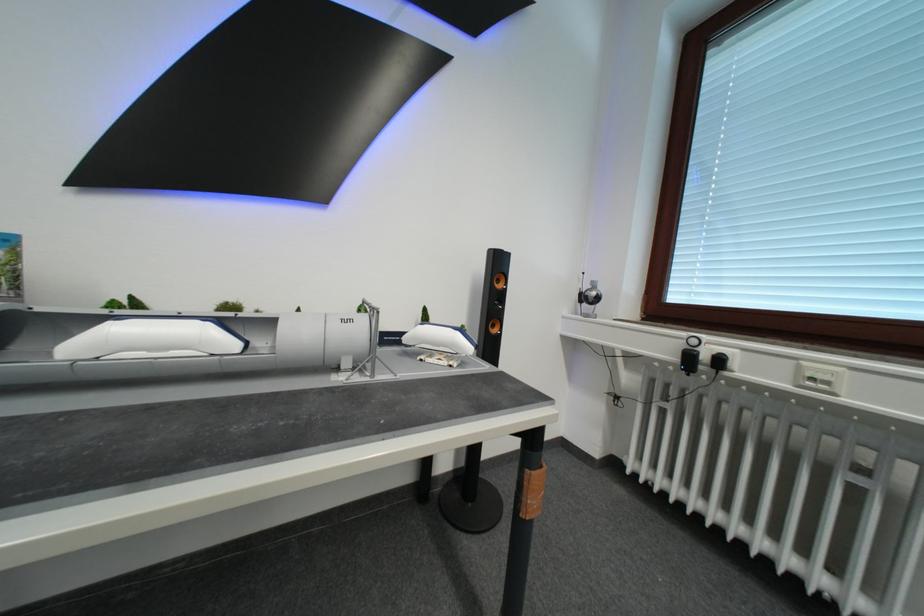
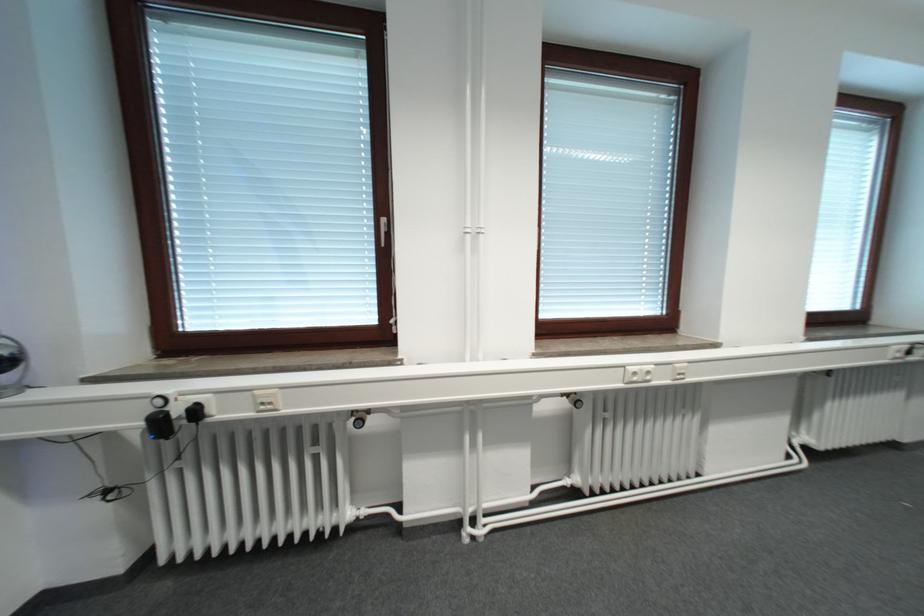
Question: The camera is either moving clockwise (left) or counter-clockwise (right) around the object. The first image is from the beginning of the video and the second image is from the end. Is the camera moving left or right when shooting the video?

Choices:
 (A) Left
 (B) Right

Answer: (A)